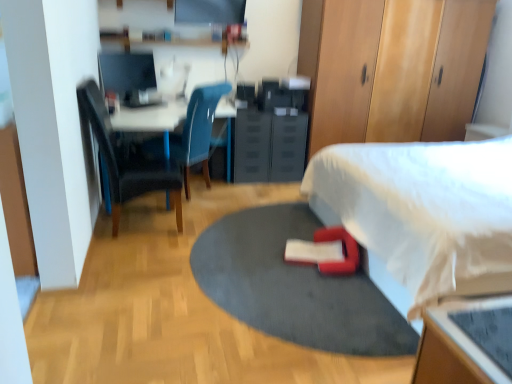
Question: Is red fabric bean bag chair at lower center spatially inside red rubber yoga mat at center, or outside of it?

Choices:
 (A) inside
 (B) outside

Answer: (B)

Question: From a real-world perspective, is red fabric bean bag chair at lower center above or below red rubber yoga mat at center?

Choices:
 (A) above
 (B) below

Answer: (A)

Question: Which object is positioned farthest from the black plastic drawer at center?

Choices:
 (A) matte black monitor at upper left
 (B) white fabric bed at lower right
 (C) wooden dresser at upper right, the 2th dresser viewed from the left
 (D) dark blue fabric chair at left, marked as the first chair in a front-to-back arrangement
 (E) matte blue chair at center, which ranks as the second chair in front-to-back order

Answer: (B)

Question: Which object is positioned closest to the white glossy desk at upper left?

Choices:
 (A) matte blue chair at center, which ranks as the second chair in front-to-back order
 (B) dark blue fabric chair at left, marked as the first chair in a front-to-back arrangement
 (C) red rubber yoga mat at center
 (D) black plastic drawer at center
 (E) red fabric bean bag chair at lower center

Answer: (A)